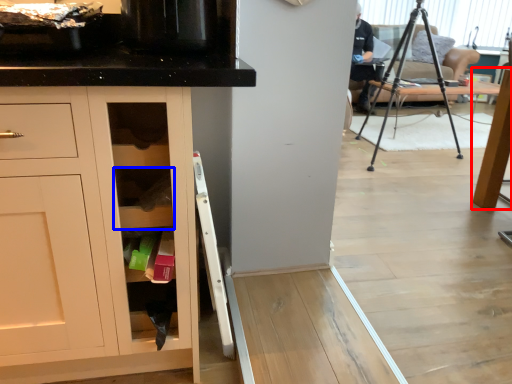
Question: Which object appears farthest to the camera in this image, table (highlighted by a red box) or shelf (highlighted by a blue box)?

Choices:
 (A) table
 (B) shelf

Answer: (A)